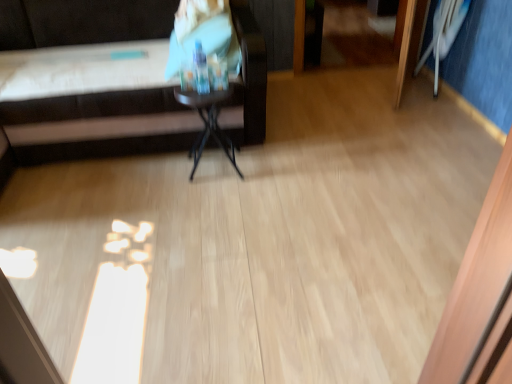
Locate an element on the screen. The image size is (512, 384). vacant area that lies between brown leather couch at upper left and white plastic swivel chair at upper right is located at coordinates (330, 105).